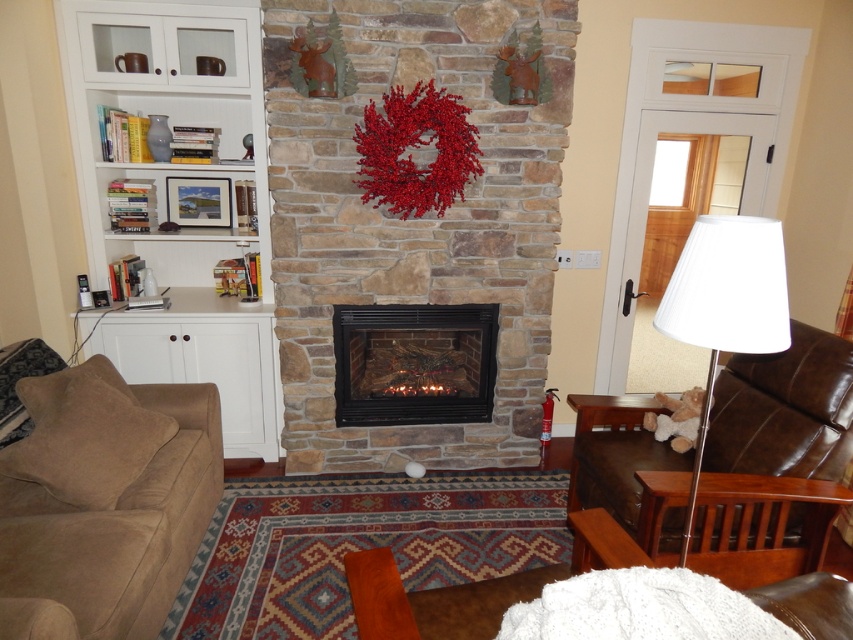
Question: Which point is farther to the camera?

Choices:
 (A) suede couch at left
 (B) brown leather armchair at right

Answer: (B)

Question: Which point is farther from the camera taking this photo?

Choices:
 (A) click(x=416, y=365)
 (B) click(x=601, y=486)

Answer: (A)

Question: Does white wood bookshelf at left appear under brown leather armchair at right?

Choices:
 (A) no
 (B) yes

Answer: (A)

Question: Can you confirm if black glass fireplace at center is wider than white fabric lampshade at right?

Choices:
 (A) no
 (B) yes

Answer: (B)

Question: Is suede couch at left above black glass fireplace at center?

Choices:
 (A) no
 (B) yes

Answer: (A)

Question: Which point is farther to the camera?

Choices:
 (A) white wood bookshelf at left
 (B) black glass fireplace at center
 (C) brown leather armchair at right

Answer: (B)